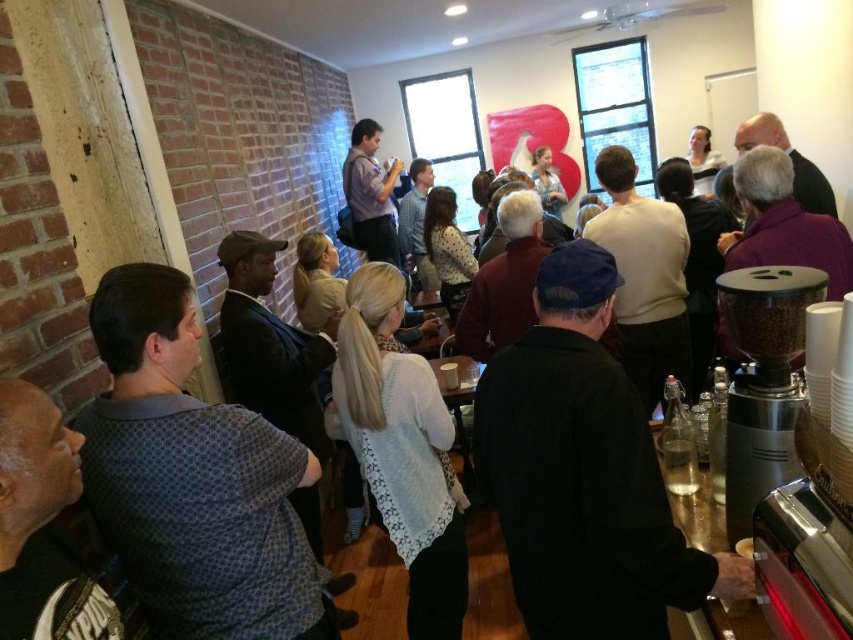
Which is more to the right, metallic gray coffee grinder at right or smooth white cup at lower right?

Positioned to the right is metallic gray coffee grinder at right.

Does metallic gray coffee grinder at right have a larger size compared to smooth white cup at lower right?

Yes.

Is point (753, 275) less distant than point (743, 545)?

Yes, point (753, 275) is in front of point (743, 545).

You are a GUI agent. You are given a task and a screenshot of the screen. Output one action in this format:
    pyautogui.click(x=<x>, y=<y>)
    Task: Click on the metallic gray coffee grinder at right
    This screenshot has width=853, height=640.
    Given the screenshot: What is the action you would take?
    pyautogui.click(x=763, y=381)